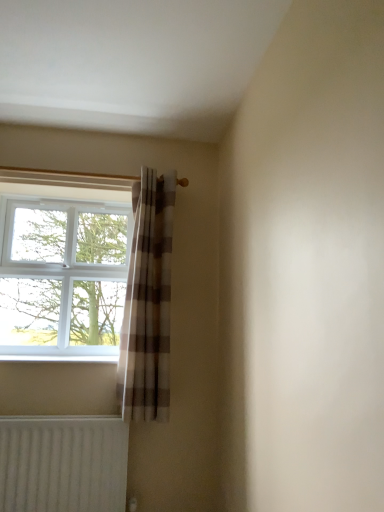
Question: Could white plastic window at left be considered to be inside plaid fabric curtain at center?

Choices:
 (A) yes
 (B) no

Answer: (B)

Question: Does plaid fabric curtain at center touch white plastic window at left?

Choices:
 (A) no
 (B) yes

Answer: (A)

Question: From a real-world perspective, is plaid fabric curtain at center over white plastic window at left?

Choices:
 (A) no
 (B) yes

Answer: (A)

Question: Is plaid fabric curtain at center to the left of white plastic window at left from the viewer's perspective?

Choices:
 (A) no
 (B) yes

Answer: (A)

Question: Does plaid fabric curtain at center have a greater width compared to white plastic window at left?

Choices:
 (A) no
 (B) yes

Answer: (B)

Question: From the image's perspective, would you say plaid fabric curtain at center is positioned over white plastic window at left?

Choices:
 (A) yes
 (B) no

Answer: (B)

Question: Is white plastic window at left smaller than plaid fabric curtain at center?

Choices:
 (A) yes
 (B) no

Answer: (B)

Question: Can plaid fabric curtain at center be found inside white plastic window at left?

Choices:
 (A) yes
 (B) no

Answer: (B)

Question: From the image's perspective, would you say white plastic window at left is shown under plaid fabric curtain at center?

Choices:
 (A) no
 (B) yes

Answer: (A)

Question: From a real-world perspective, is white plastic window at left physically above plaid fabric curtain at center?

Choices:
 (A) yes
 (B) no

Answer: (A)

Question: Is white plastic window at left aimed at plaid fabric curtain at center?

Choices:
 (A) no
 (B) yes

Answer: (B)

Question: Is white plastic window at left not close to plaid fabric curtain at center?

Choices:
 (A) yes
 (B) no

Answer: (B)

Question: From a real-world perspective, is white ribbed radiator at lower left physically below plaid fabric curtain at center?

Choices:
 (A) yes
 (B) no

Answer: (A)